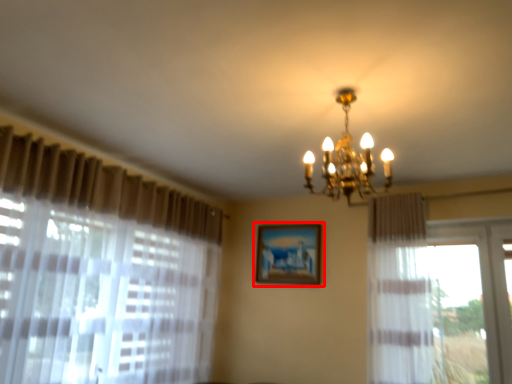
Question: From the image, what is the correct spatial relationship of picture frame (annotated by the red box) in relation to lamp?

Choices:
 (A) right
 (B) left

Answer: (B)